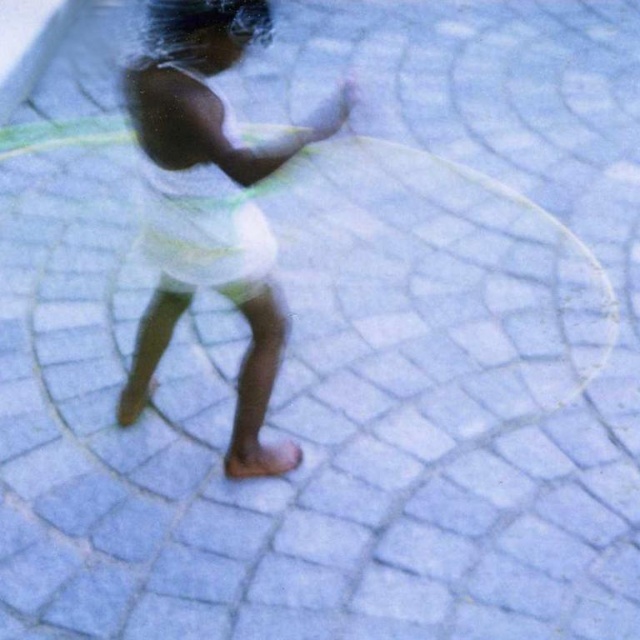
Question: Which object is closer to the camera taking this photo?

Choices:
 (A) white cotton dress at center
 (B) smooth white dress at center

Answer: (A)

Question: Is smooth white dress at center above white cotton dress at center?

Choices:
 (A) yes
 (B) no

Answer: (B)

Question: Can you confirm if smooth white dress at center is positioned to the left of white cotton dress at center?

Choices:
 (A) no
 (B) yes

Answer: (B)

Question: Does smooth white dress at center lie behind white cotton dress at center?

Choices:
 (A) no
 (B) yes

Answer: (B)

Question: Which point is closer to the camera?

Choices:
 (A) (186, 56)
 (B) (164, 97)

Answer: (B)